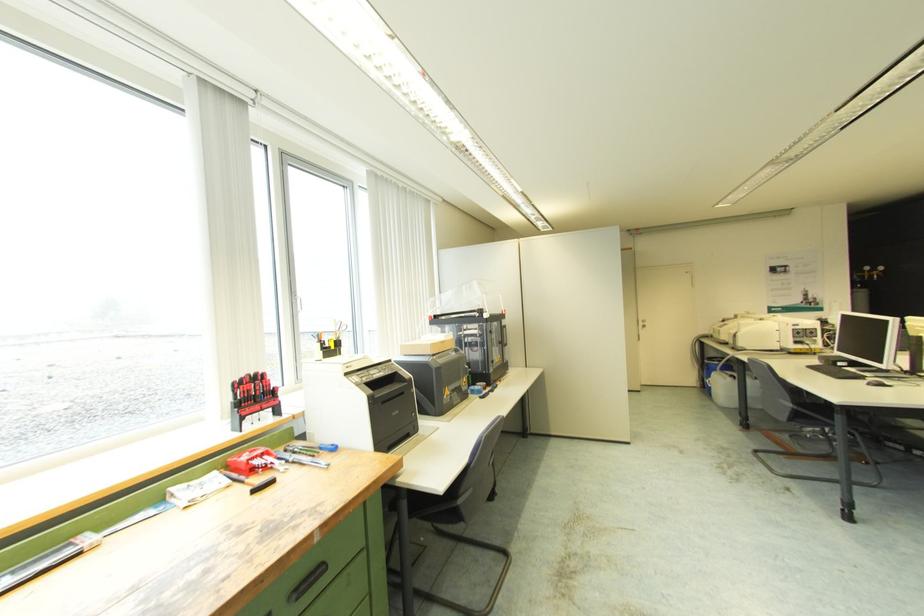
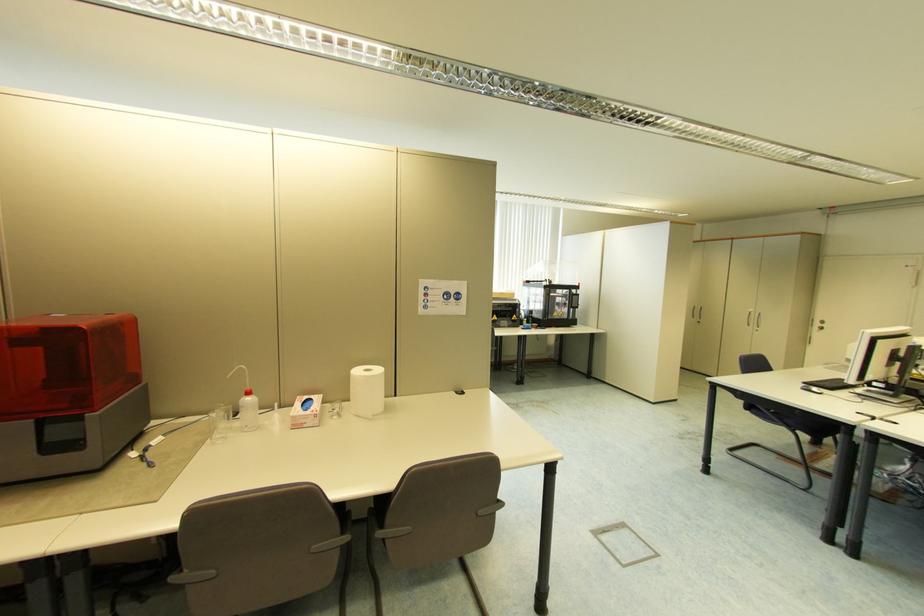
In the second image, find the point that corresponds to (x=645, y=323) in the first image.

(821, 325)